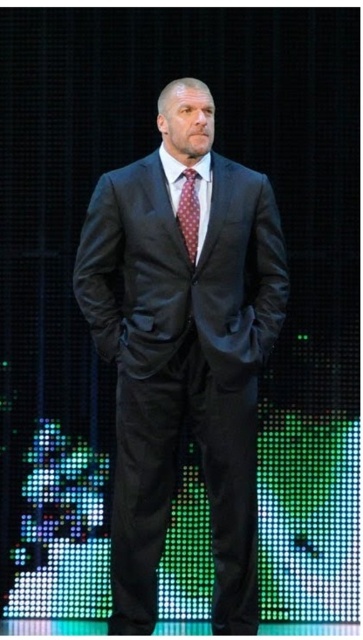
You are a fashion designer preparing for a photoshoot and need to ensure that the matte black suit at center and the polka dot silk tie at center are visible in the final image. Given their sizes, which one should you focus your camera on to capture both items clearly?

The matte black suit at center is larger in size than the polka dot silk tie at center, so you should focus on the matte black suit at center to ensure both items are visible in the photo.

You are a costume designer preparing for a photoshoot. You need to ensure that the distance between the matte black suit at center and the polka dot silk tie at center is exactly 18 inches. Based on the image provided, will the current positioning meet your requirement?

The distance between the matte black suit at center and the polka dot silk tie at center is 18.02 inches, which is just slightly over the required 18 inches. Therefore, the current positioning meets the requirement as it is very close to the specified distance.